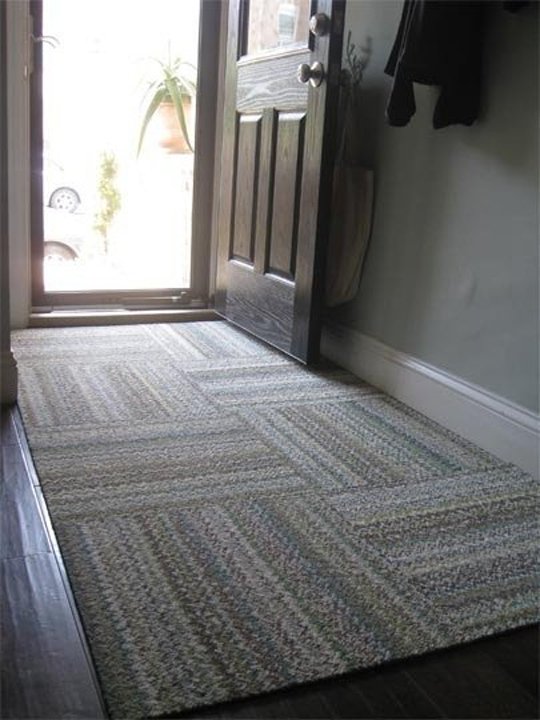
Identify the location of wall behind open door. (351, 12).